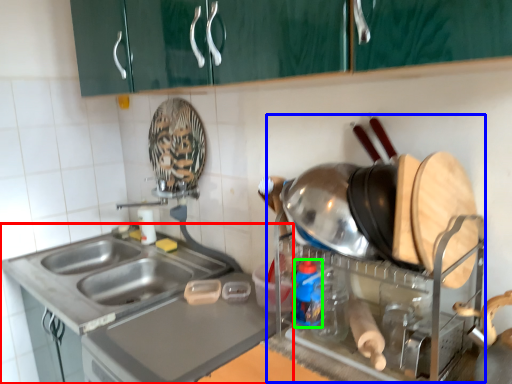
Question: Which object is positioned farthest from countertop (highlighted by a red box)? Select from appliance (highlighted by a blue box) and bottle (highlighted by a green box).

Choices:
 (A) appliance
 (B) bottle

Answer: (B)